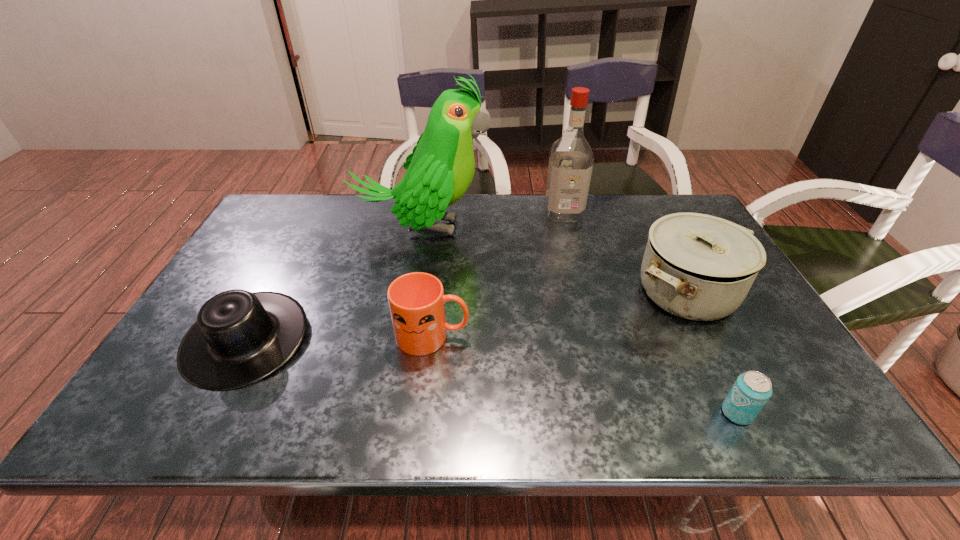
Find the location of `unoccupied area between the beer can and the dress hat`. unoccupied area between the beer can and the dress hat is located at coordinates (492, 376).

Image resolution: width=960 pixels, height=540 pixels. I want to click on free space between the beer can and the fourth tallest object, so click(585, 374).

Point out which object is positioned as the second nearest to the saucepan. Please provide its 2D coordinates. Your answer should be formatted as a tuple, i.e. [(x, y)], where the tuple contains the x and y coordinates of a point satisfying the conditions above.

[(750, 392)]

Select which object appears as the fifth closest to the saucepan. Please provide its 2D coordinates. Your answer should be formatted as a tuple, i.e. [(x, y)], where the tuple contains the x and y coordinates of a point satisfying the conditions above.

[(240, 337)]

At what (x,y) coordinates should I click in order to perform the action: click on vacant space that satisfies the following two spatial constraints: 1. on the beak of the parakeet; 2. on the left side of the saucepan. Please return your answer as a coordinate pair (x, y). The width and height of the screenshot is (960, 540). Looking at the image, I should click on (412, 292).

Where is `vacant space that satisfies the following two spatial constraints: 1. on the beak of the beer can; 2. on the right side of the parakeet`? Image resolution: width=960 pixels, height=540 pixels. vacant space that satisfies the following two spatial constraints: 1. on the beak of the beer can; 2. on the right side of the parakeet is located at coordinates (391, 413).

Identify the location of vacant space that satisfies the following two spatial constraints: 1. on the handle side of the mug; 2. on the right side of the nearest object. (424, 413).

I want to click on free location that satisfies the following two spatial constraints: 1. on the beak of the parakeet; 2. on the front side of the leftmost object, so click(x=403, y=339).

At what (x,y) coordinates should I click in order to perform the action: click on vacant region that satisfies the following two spatial constraints: 1. on the front-facing side of the fourth object from left to right; 2. on the beak of the parakeet. Please return your answer as a coordinate pair (x, y). This screenshot has width=960, height=540. Looking at the image, I should click on (567, 228).

Locate an element on the screen. Image resolution: width=960 pixels, height=540 pixels. free location that satisfies the following two spatial constraints: 1. on the handle side of the mug; 2. on the back side of the nearest object is located at coordinates (424, 413).